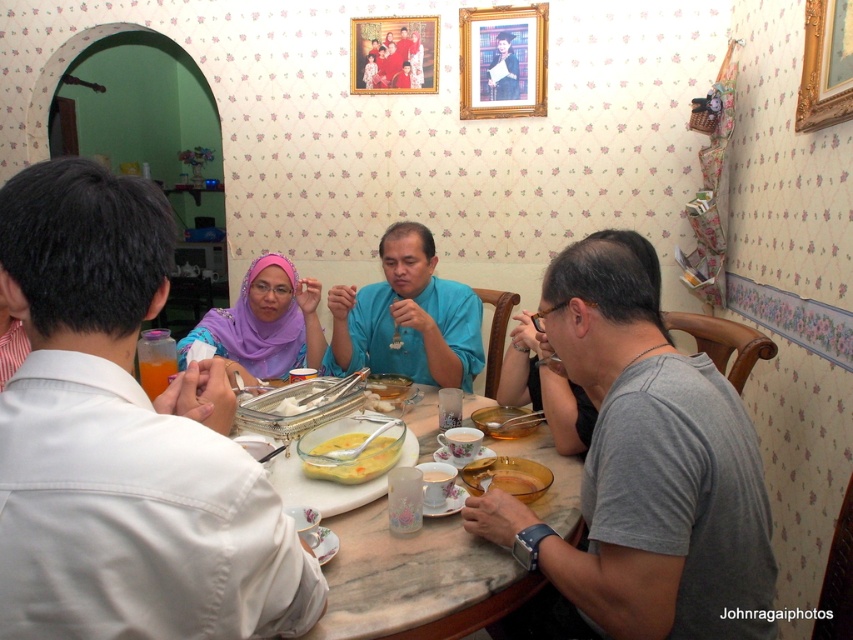
Question: Can you confirm if marble table at center is positioned to the right of matte blue shirt at center?

Choices:
 (A) no
 (B) yes

Answer: (A)

Question: Is gold wooden picture frame at upper center smaller than yellow matte soup bowl at center?

Choices:
 (A) yes
 (B) no

Answer: (B)

Question: Which of the following is the closest to the observer?

Choices:
 (A) (212, 525)
 (B) (430, 310)
 (C) (498, 92)

Answer: (A)

Question: Which object is the closest to the gray cotton t-shirt at right?

Choices:
 (A) matte plastic bowl at center
 (B) gold ornate picture frame at upper right
 (C) marble table at center

Answer: (C)

Question: Among these points, which one is nearest to the camera?

Choices:
 (A) (728, 560)
 (B) (503, 476)
 (C) (541, 74)
 (D) (352, 572)

Answer: (A)

Question: Is marble table at center positioned before blue silk shirt at center?

Choices:
 (A) yes
 (B) no

Answer: (A)